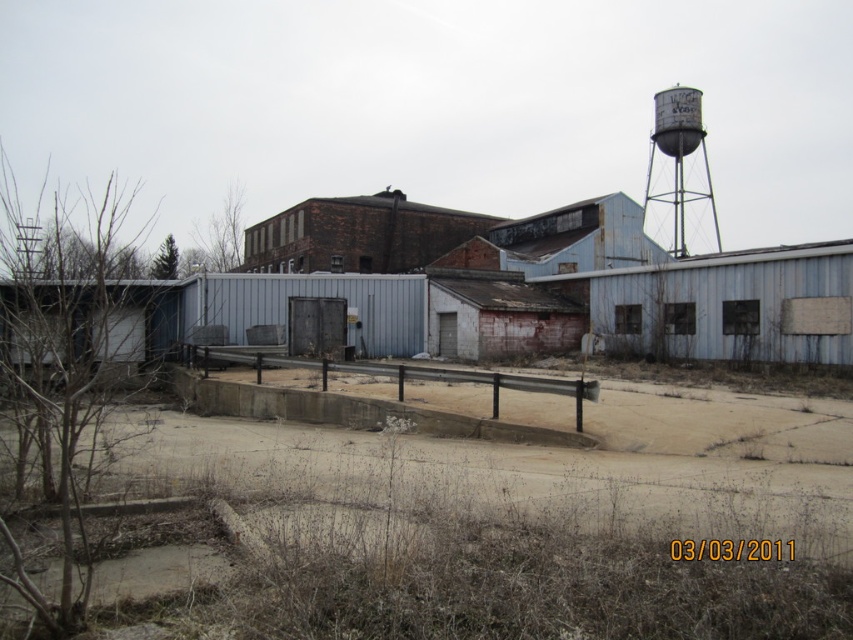
Can you confirm if brown dirt field at center is shorter than rusty metal water tower at upper right?

Yes.

Which is in front, point (444, 472) or point (711, 216)?

Positioned in front is point (444, 472).

Who is more distant from viewer, [520,540] or [699,138]?

Positioned behind is point [699,138].

At what (x,y) coordinates should I click in order to perform the action: click on brown dirt field at center. Please return your answer as a coordinate pair (x, y). The height and width of the screenshot is (640, 853). Looking at the image, I should click on (495, 522).